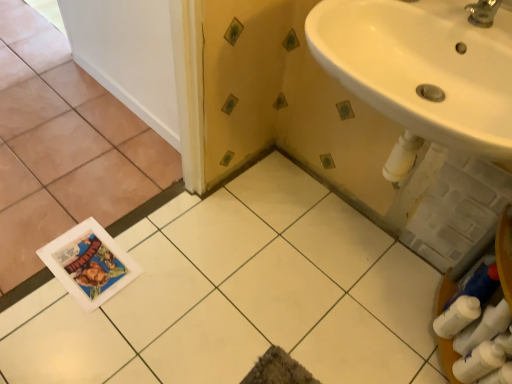
Question: From a real-world perspective, relative to white glossy tile at center, arranged as the 2th ceramic tile when viewed from the left, is white glossy tile at lower left, which is the second ceramic tile in right-to-left order, vertically above or below?

Choices:
 (A) above
 (B) below

Answer: (A)

Question: Considering the positions of point (5, 231) and point (116, 299), is point (5, 231) closer or farther from the camera than point (116, 299)?

Choices:
 (A) closer
 (B) farther

Answer: (B)

Question: Which object is positioned closest to the white glossy sink at upper right?

Choices:
 (A) white smooth door at upper left
 (B) white glossy tile at center, marked as the 1th ceramic tile in a right-to-left arrangement
 (C) white glossy tile at lower left, which is the second ceramic tile in right-to-left order
 (D) white matte toilet paper at lower right

Answer: (D)

Question: Considering the real-world distances, which object is farthest from the white glossy tile at center, marked as the 1th ceramic tile in a right-to-left arrangement?

Choices:
 (A) white glossy sink at upper right
 (B) white smooth door at upper left
 (C) white glossy tile at lower left, which appears as the 1th ceramic tile when viewed from the left
 (D) white matte toilet paper at lower right

Answer: (A)